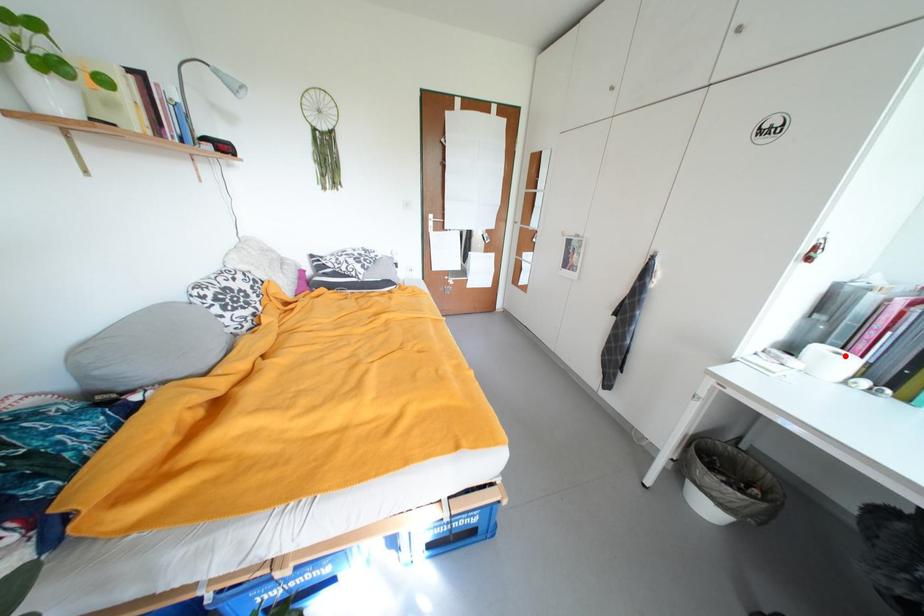
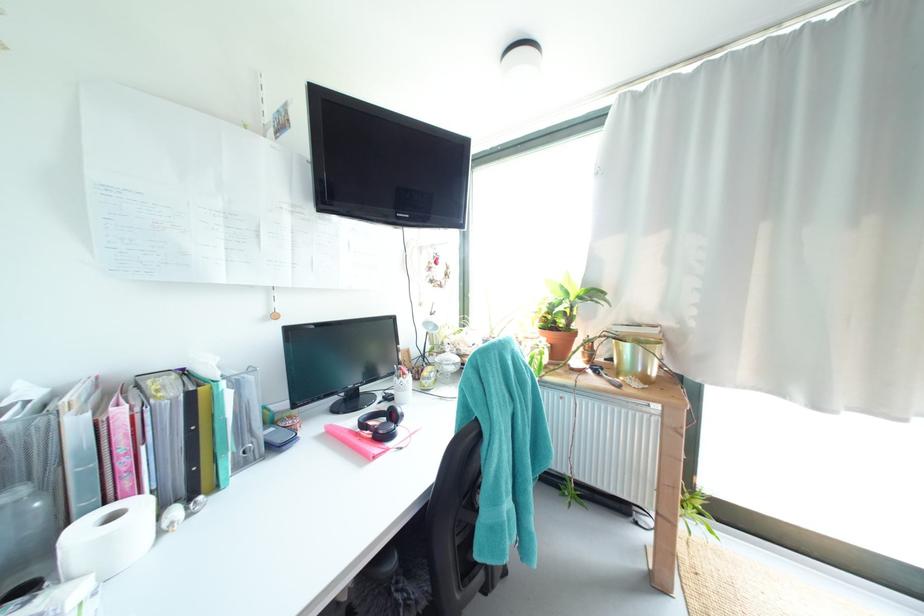
Question: I am providing you with two images of the same scene from different viewpoints. A red point is marked on the first image. At the location where the point appears in image 1, is it still visible in image 2?

Choices:
 (A) Yes
 (B) No

Answer: (A)